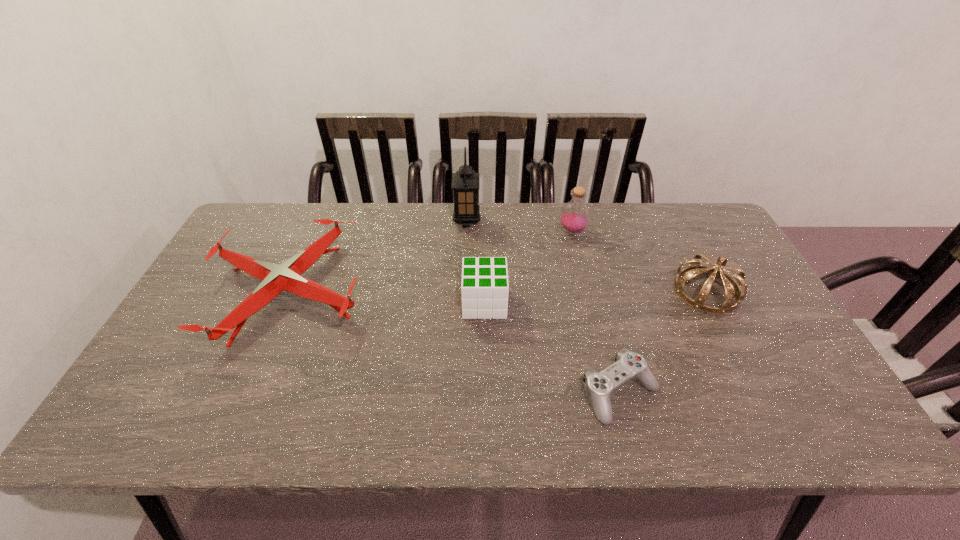
Where is `vacant space located 0.350m on the left of the rightmost object`? vacant space located 0.350m on the left of the rightmost object is located at coordinates (551, 291).

The height and width of the screenshot is (540, 960). What are the coordinates of `free region located on the red face of the cube` in the screenshot? It's located at (434, 303).

This screenshot has height=540, width=960. In order to click on vacant space located 0.310m on the red face of the cube in this screenshot , I will do 351,303.

The image size is (960, 540). Find the location of `free point located 0.110m on the red face of the cube`. free point located 0.110m on the red face of the cube is located at coordinates (423, 303).

Find the location of `vacant space located on the right of the leftmost object`. vacant space located on the right of the leftmost object is located at coordinates (454, 292).

Locate an element on the screen. The image size is (960, 540). free region located on the left of the shortest object is located at coordinates (513, 393).

Locate an element on the screen. lantern that is positioned at the far edge is located at coordinates (465, 182).

At what (x,y) coordinates should I click in order to perform the action: click on bottle at the far edge. Please return your answer as a coordinate pair (x, y). Looking at the image, I should click on (574, 217).

This screenshot has width=960, height=540. Identify the location of drone at the far edge. [275, 278].

Find the location of a particular element. This screenshot has height=540, width=960. object located in the near edge section of the desktop is located at coordinates coord(628,365).